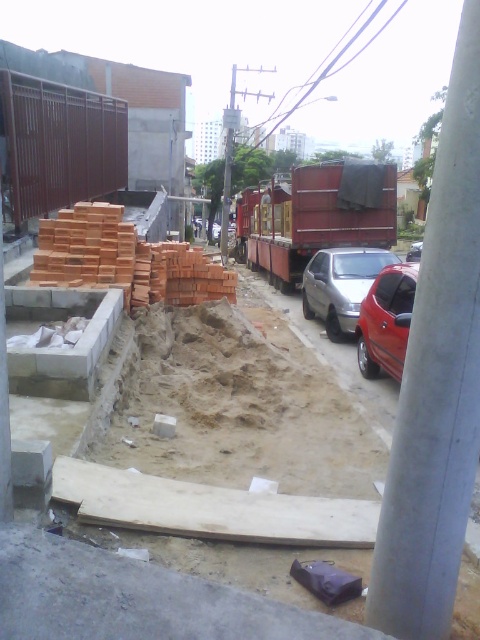
Consider the image. You are a delivery driver who needs to park your vehicle at the construction site. The parking area is marked by a gray concrete pole at right. What are the coordinates of the parking area?

The coordinates of the parking area marked by the gray concrete pole at right are at point (436, 384).